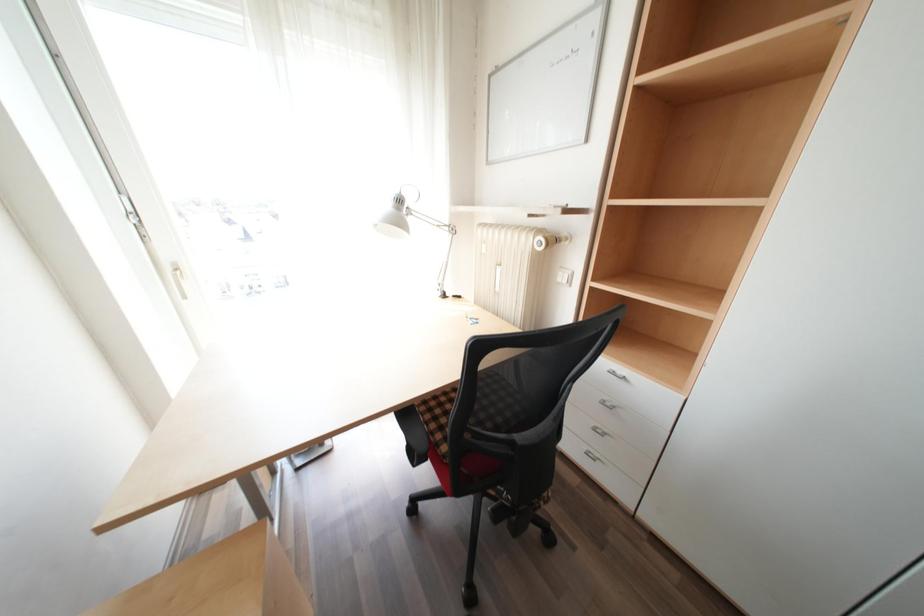
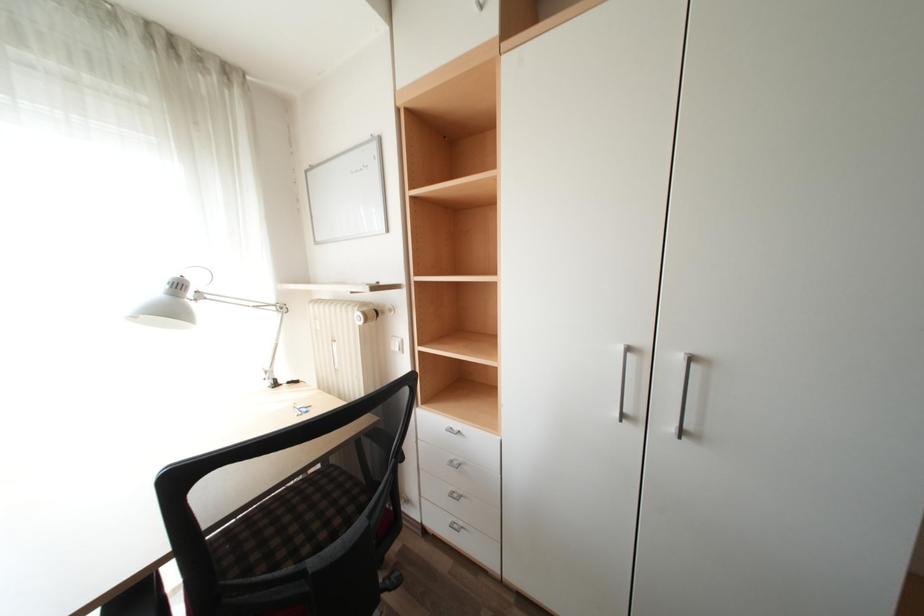
Question: The camera is either moving clockwise (left) or counter-clockwise (right) around the object. The first image is from the beginning of the video and the second image is from the end. Is the camera moving left or right when shooting the video?

Choices:
 (A) Left
 (B) Right

Answer: (A)